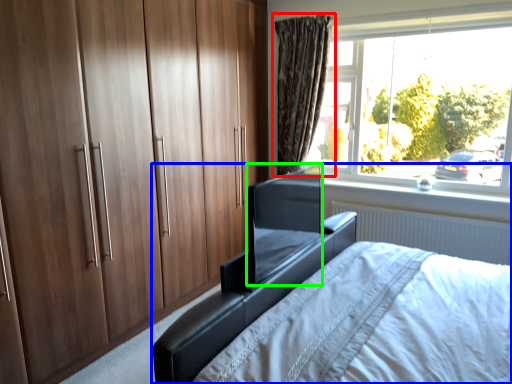
Question: Which object is the closest to the curtain (highlighted by a red box)? Choose among these: bed (highlighted by a blue box) or window screen (highlighted by a green box).

Choices:
 (A) bed
 (B) window screen

Answer: (A)